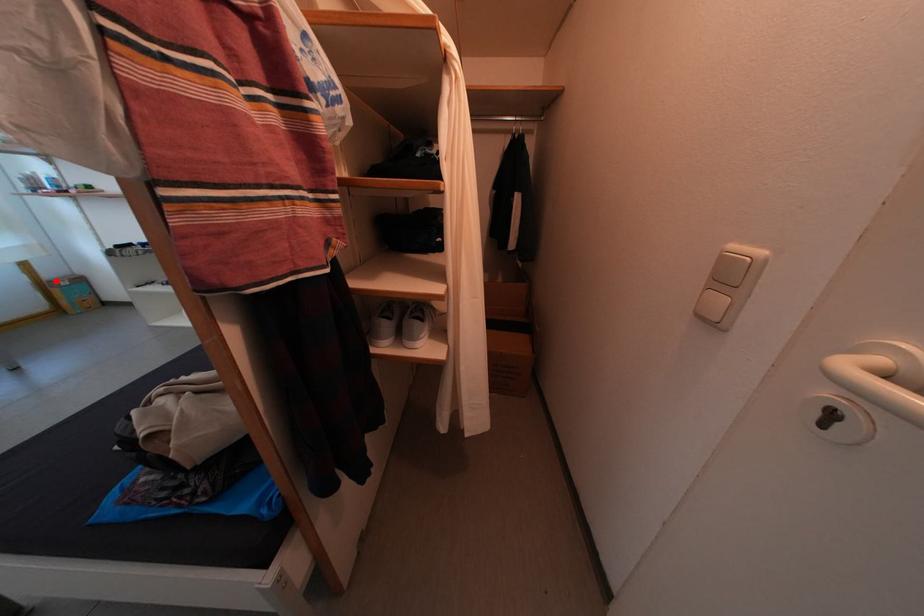
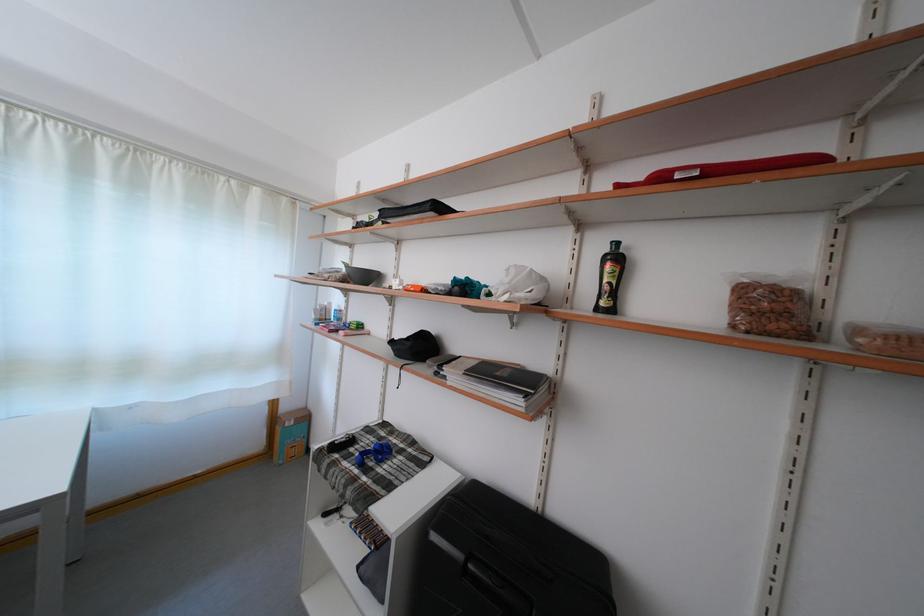
Locate, in the second image, the point that corresponds to the highlighted location in the first image.

(293, 415)